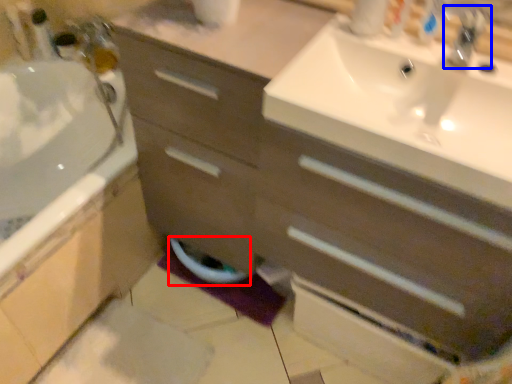
Question: Which point is closer to the camera, toilet bowl (highlighted by a red box) or tap (highlighted by a blue box)?

Choices:
 (A) toilet bowl
 (B) tap

Answer: (B)